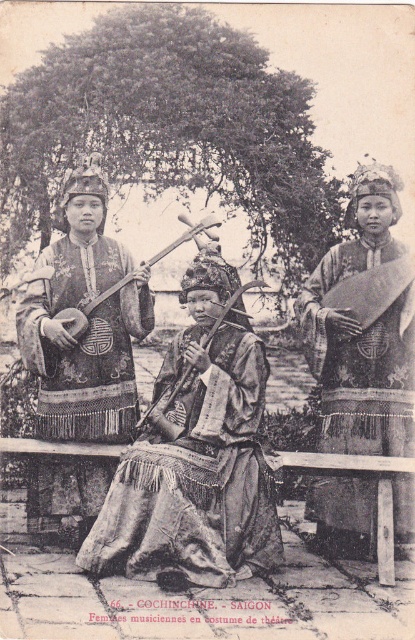
Measure the distance between silky brocade robe at center and silky dark brown robe at center.

silky brocade robe at center and silky dark brown robe at center are 2.85 meters apart from each other.

Which of these two, silky brocade robe at center or silky dark brown robe at center, stands shorter?

With less height is silky dark brown robe at center.

You are a GUI agent. You are given a task and a screenshot of the screen. Output one action in this format:
    pyautogui.click(x=<x>, y=<y>)
    Task: Click on the silky brocade robe at center
    Image resolution: width=415 pixels, height=640 pixels.
    Given the screenshot: What is the action you would take?
    pyautogui.click(x=197, y=481)

Between silky brocade robe at center and silky brocade robe at right, which one is positioned lower?

silky brocade robe at center is lower down.

Between silky brocade robe at center and silky brocade robe at right, which one has less height?

Standing shorter between the two is silky brocade robe at right.

Which is in front, point (175, 372) or point (371, 525)?

Point (371, 525) is in front.

Locate an element on the screen. silky brocade robe at center is located at coordinates (197, 481).

Does silky dark brown robe at center appear on the left side of silky brocade robe at right?

Indeed, silky dark brown robe at center is positioned on the left side of silky brocade robe at right.

Between point (68, 204) and point (359, 253), which one is positioned behind?

Point (68, 204)

Does point (56, 337) come in front of point (397, 328)?

Yes, point (56, 337) is closer to viewer.

This screenshot has height=640, width=415. What are the coordinates of `silky dark brown robe at center` in the screenshot? It's located at (88, 323).